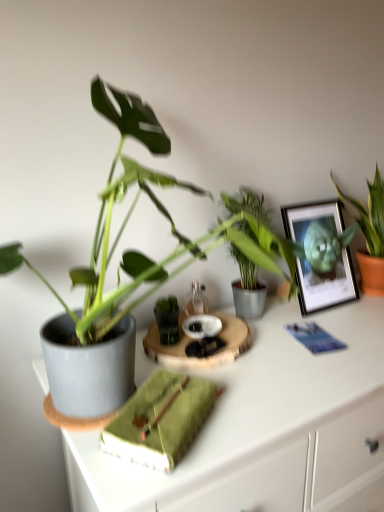
Question: Is green fabric book at center turned away from matte gray pot at left?

Choices:
 (A) no
 (B) yes

Answer: (A)

Question: From the image's perspective, does green fabric book at center appear lower than matte gray pot at left?

Choices:
 (A) yes
 (B) no

Answer: (B)

Question: Is matte gray pot at left inside green fabric book at center?

Choices:
 (A) no
 (B) yes

Answer: (A)

Question: Can you confirm if green fabric book at center is bigger than matte gray pot at left?

Choices:
 (A) no
 (B) yes

Answer: (A)

Question: Are green fabric book at center and matte gray pot at left making contact?

Choices:
 (A) yes
 (B) no

Answer: (B)

Question: Does green fabric book at center have a greater width compared to matte gray pot at left?

Choices:
 (A) yes
 (B) no

Answer: (B)

Question: Is metallic silver picture frame at upper right smaller than green fabric book at center?

Choices:
 (A) no
 (B) yes

Answer: (A)

Question: From the image's perspective, is metallic silver picture frame at upper right beneath green fabric book at center?

Choices:
 (A) yes
 (B) no

Answer: (B)

Question: From a real-world perspective, is metallic silver picture frame at upper right below green fabric book at center?

Choices:
 (A) no
 (B) yes

Answer: (A)

Question: From the image's perspective, is metallic silver picture frame at upper right on green fabric book at center?

Choices:
 (A) no
 (B) yes

Answer: (B)

Question: Would you say metallic silver picture frame at upper right is a long distance from green fabric book at center?

Choices:
 (A) yes
 (B) no

Answer: (B)

Question: Is green fabric book at center a part of metallic silver picture frame at upper right?

Choices:
 (A) yes
 (B) no

Answer: (B)

Question: Is green leafy plant at upper right, the 1th houseplant viewed from the back, at the right side of matte gray pot at left?

Choices:
 (A) no
 (B) yes

Answer: (B)